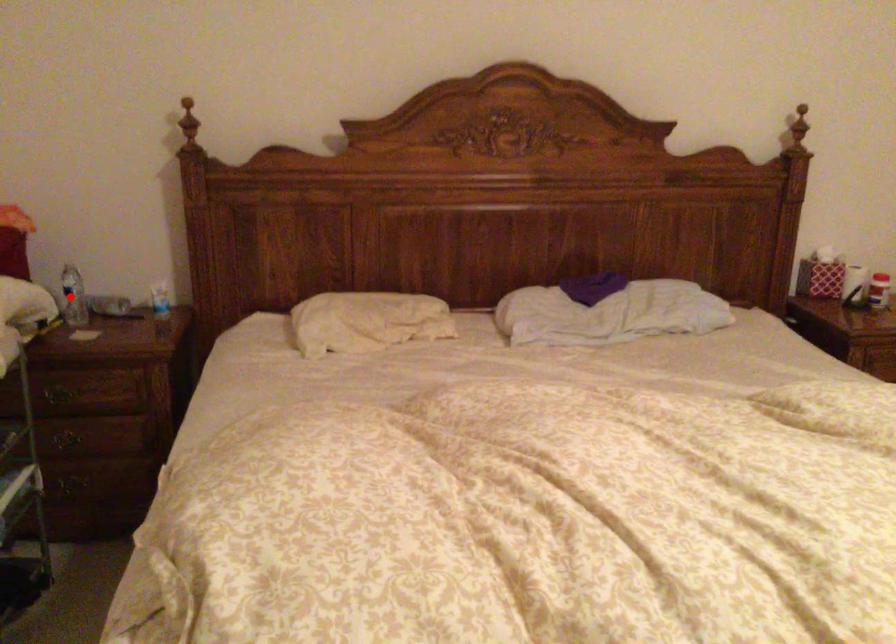
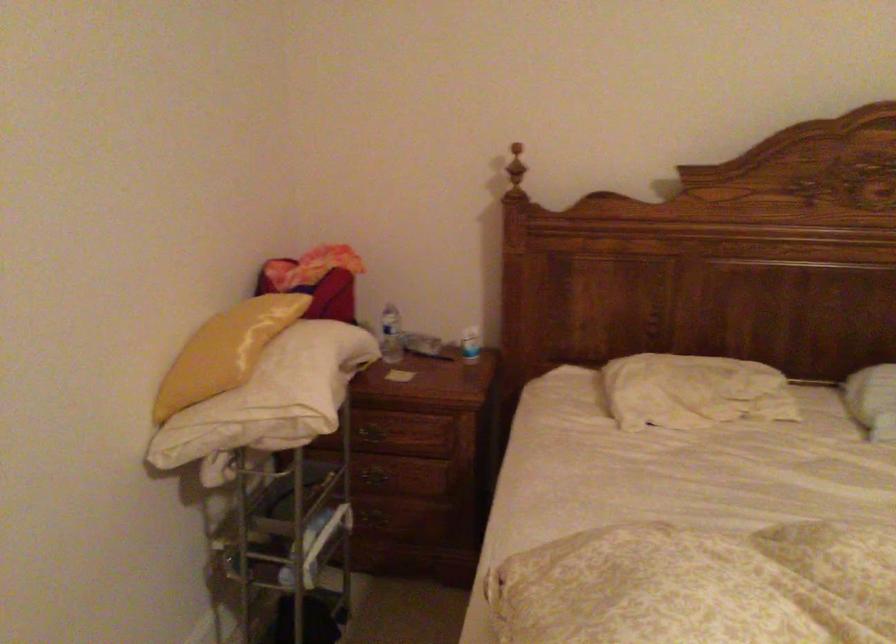
The point at the highlighted location is marked in the first image. Where is the corresponding point in the second image?

(391, 335)